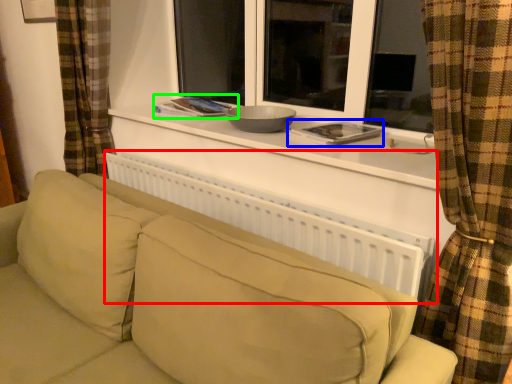
Question: Which object is the closest to the radiator (highlighted by a red box)? Choose among these: book (highlighted by a blue box) or book (highlighted by a green box).

Choices:
 (A) book
 (B) book

Answer: (A)